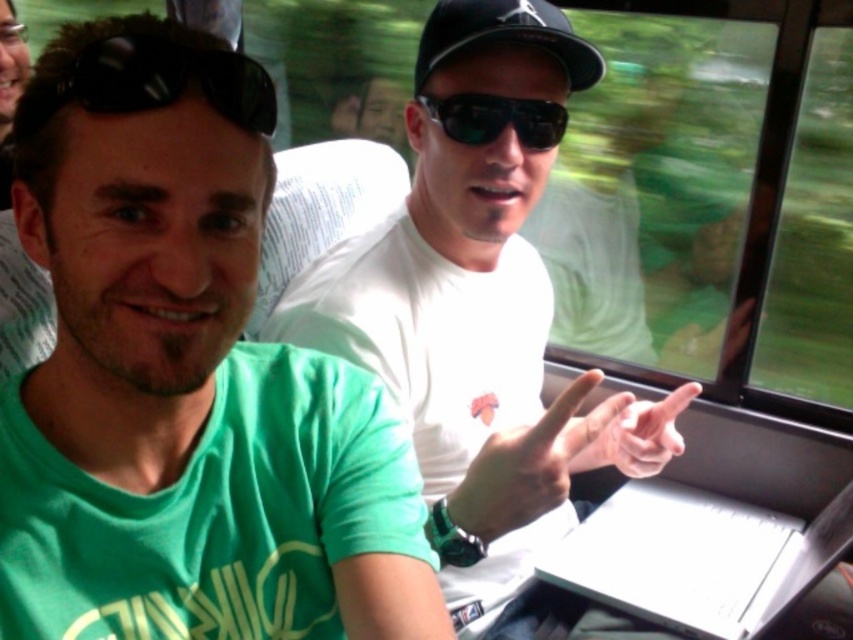
Which is more to the left, green matte t-shirt at left or black matte sunglasses at upper left?

From the viewer's perspective, green matte t-shirt at left appears more on the left side.

Is green matte t-shirt at left wider than black matte sunglasses at upper left?

Yes.

Does point (213, 568) lie in front of point (76, 61)?

That is False.

Where is `green matte t-shirt at left`? This screenshot has width=853, height=640. green matte t-shirt at left is located at coordinates (184, 378).

Is point (737, 502) farther from viewer compared to point (113, 81)?

Yes, point (737, 502) is farther from viewer.

Who is positioned more to the right, white glossy laptop at center or black matte sunglasses at upper left?

white glossy laptop at center is more to the right.

Locate an element on the screen. white glossy laptop at center is located at coordinates (698, 557).

Does black matte sunglasses at upper left have a lesser width compared to sunglasses at center?

Indeed, black matte sunglasses at upper left has a lesser width compared to sunglasses at center.

How distant is black matte sunglasses at upper left from sunglasses at center?

A distance of 16.63 inches exists between black matte sunglasses at upper left and sunglasses at center.

Who is more forward, (114, 90) or (469, 131)?

Point (114, 90)

Find the location of a particular element. Image resolution: width=853 pixels, height=640 pixels. black matte sunglasses at upper left is located at coordinates (169, 80).